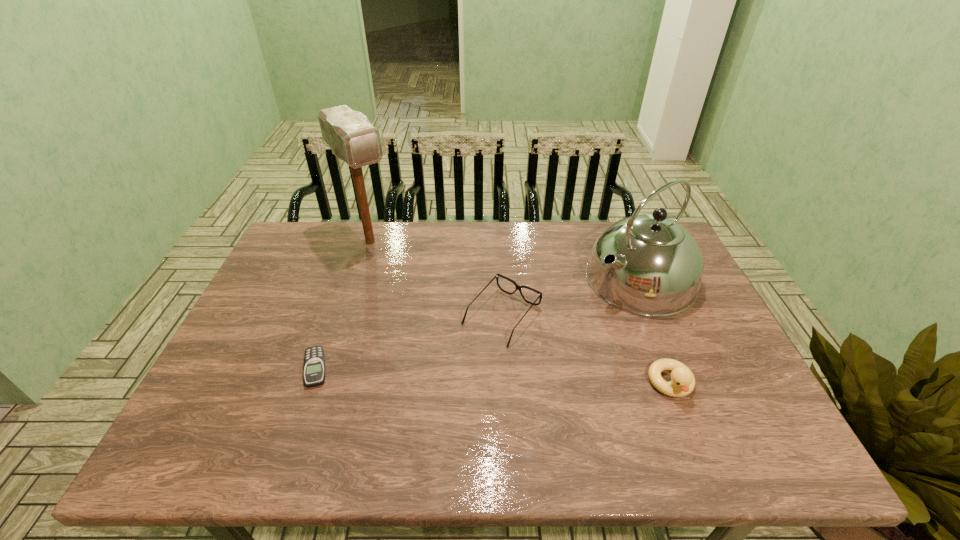
Locate an element on the screen. The image size is (960, 540). object that stands as the closest to the spectacles is located at coordinates (658, 270).

Identify the location of object that stands as the second closest to the kettle. The image size is (960, 540). (682, 383).